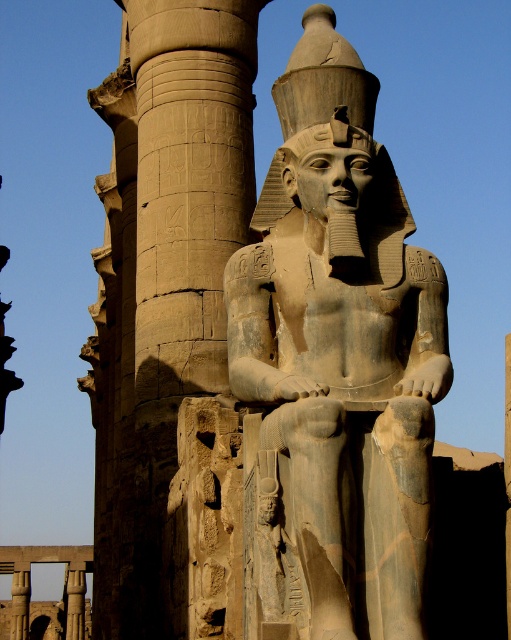
This screenshot has height=640, width=511. Describe the element at coordinates (335, 365) in the screenshot. I see `gray stone statue at center` at that location.

Where is `gray stone statue at center`? The height and width of the screenshot is (640, 511). gray stone statue at center is located at coordinates (335, 365).

You are a GUI agent. You are given a task and a screenshot of the screen. Output one action in this format:
    pyautogui.click(x=<x>, y=<y>)
    Task: Click on the gray stone statue at center
    
    Given the screenshot: What is the action you would take?
    pyautogui.click(x=335, y=365)